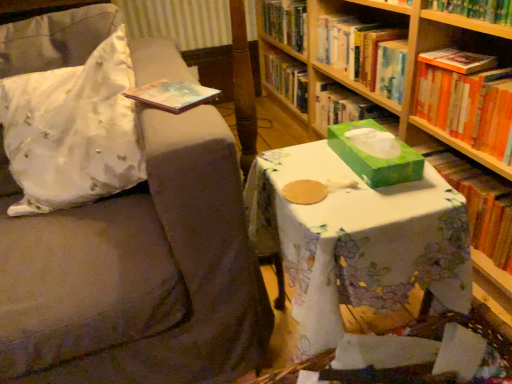
What do you see at coordinates (361, 51) in the screenshot? I see `hardcover book at upper right, the 1th book positioned from the top` at bounding box center [361, 51].

The image size is (512, 384). What are the coordinates of `white satin pillow at upper left` in the screenshot? It's located at (73, 131).

Identify the location of green paper book at right, which ranks as the 1th book in bottom-to-top order. The image size is (512, 384). (478, 202).

Describe the element at coordinates (375, 157) in the screenshot. I see `green paper tissue box at center` at that location.

Find the location of a particular element. The width and height of the screenshot is (512, 384). hardcover book at upper right, the 1th book positioned from the top is located at coordinates (361, 51).

From a real-world perspective, is white satin pillow at upper left positioned above or below green paper book at right, arranged as the 3th book when viewed from the top?

white satin pillow at upper left is situated higher than green paper book at right, arranged as the 3th book when viewed from the top, in the real world.

Between white satin pillow at upper left and green paper book at right, which ranks as the 1th book in bottom-to-top order, which one appears on the right side from the viewer's perspective?

Positioned to the right is green paper book at right, which ranks as the 1th book in bottom-to-top order.

Who is smaller, white satin pillow at upper left or green paper book at right, arranged as the 3th book when viewed from the top?

green paper book at right, arranged as the 3th book when viewed from the top.

Which of these two, white satin pillow at upper left or green paper book at right, arranged as the 3th book when viewed from the top, stands shorter?

With less height is green paper book at right, arranged as the 3th book when viewed from the top.

Are hardcover book at upper right, the 1th book positioned from the top, and orange hardcover book at right, the second book positioned from the bottom, far apart?

No, hardcover book at upper right, the 1th book positioned from the top, is in close proximity to orange hardcover book at right, the second book positioned from the bottom.

Between hardcover book at upper right, which appears as the 3th book when ordered from the bottom, and orange hardcover book at right, placed as the 2th book when sorted from top to bottom, which one has more height?

Standing taller between the two is orange hardcover book at right, placed as the 2th book when sorted from top to bottom.

Who is bigger, hardcover book at upper right, which appears as the 3th book when ordered from the bottom, or orange hardcover book at right, placed as the 2th book when sorted from top to bottom?

hardcover book at upper right, which appears as the 3th book when ordered from the bottom, is bigger.

Which object is closer to the camera taking this photo, hardcover book at upper right, which appears as the 3th book when ordered from the bottom, or orange hardcover book at right, the second book positioned from the bottom?

orange hardcover book at right, the second book positioned from the bottom, is closer to the camera.

Does hardcover book at upper right, the 1th book positioned from the top, have a larger size compared to matte gray swivel chair at center?

Actually, hardcover book at upper right, the 1th book positioned from the top, might be smaller than matte gray swivel chair at center.

Looking at this image, could you tell me if hardcover book at upper right, which appears as the 3th book when ordered from the bottom, is turned towards matte gray swivel chair at center?

Yes, hardcover book at upper right, which appears as the 3th book when ordered from the bottom, is facing matte gray swivel chair at center.

Looking at this image, which object is positioned more to the left, hardcover book at upper right, which appears as the 3th book when ordered from the bottom, or matte gray swivel chair at center?

matte gray swivel chair at center is more to the left.

Are hardcover book at upper right, the 1th book positioned from the top, and matte gray swivel chair at center located far from each other?

hardcover book at upper right, the 1th book positioned from the top, is far away from matte gray swivel chair at center.

Which of these two, orange hardcover book at right, the second book positioned from the bottom, or floral-patterned cloth at center, stands shorter?

Standing shorter between the two is orange hardcover book at right, the second book positioned from the bottom.

Is orange hardcover book at right, the second book positioned from the bottom, positioned before floral-patterned cloth at center?

No, it is behind floral-patterned cloth at center.

Does orange hardcover book at right, placed as the 2th book when sorted from top to bottom, have a smaller size compared to floral-patterned cloth at center?

Indeed, orange hardcover book at right, placed as the 2th book when sorted from top to bottom, has a smaller size compared to floral-patterned cloth at center.

Are orange hardcover book at right, the second book positioned from the bottom, and floral-patterned cloth at center located far from each other?

No, orange hardcover book at right, the second book positioned from the bottom, is not far away from floral-patterned cloth at center.

From the image's perspective, is orange hardcover book at right, placed as the 2th book when sorted from top to bottom, beneath matte gray swivel chair at center?

No, from the image's perspective, orange hardcover book at right, placed as the 2th book when sorted from top to bottom, is not below matte gray swivel chair at center.

Is the position of orange hardcover book at right, placed as the 2th book when sorted from top to bottom, less distant than that of matte gray swivel chair at center?

No, orange hardcover book at right, placed as the 2th book when sorted from top to bottom, is further to the viewer.

Does point (482, 80) appear closer or farther from the camera than point (219, 176)?

Point (482, 80) appears to be farther away from the viewer than point (219, 176).

Is orange hardcover book at right, placed as the 2th book when sorted from top to bottom, oriented towards matte gray swivel chair at center?

Yes.

Is orange hardcover book at right, the second book positioned from the bottom, a part of green paper tissue box at center?

No, green paper tissue box at center does not contain orange hardcover book at right, the second book positioned from the bottom.

Is green paper tissue box at center oriented towards orange hardcover book at right, the second book positioned from the bottom?

No, green paper tissue box at center does not turn towards orange hardcover book at right, the second book positioned from the bottom.

Does green paper tissue box at center appear on the left side of orange hardcover book at right, placed as the 2th book when sorted from top to bottom?

Yes, green paper tissue box at center is to the left of orange hardcover book at right, placed as the 2th book when sorted from top to bottom.

Does hardcover book at upper right, which appears as the 3th book when ordered from the bottom, have a smaller size compared to green paper tissue box at center?

Actually, hardcover book at upper right, which appears as the 3th book when ordered from the bottom, might be larger than green paper tissue box at center.

How many degrees apart are the facing directions of hardcover book at upper right, which appears as the 3th book when ordered from the bottom, and green paper tissue box at center?

The angular difference between hardcover book at upper right, which appears as the 3th book when ordered from the bottom, and green paper tissue box at center is 87.9 degrees.

From a real-world perspective, is hardcover book at upper right, which appears as the 3th book when ordered from the bottom, positioned over green paper tissue box at center based on gravity?

Incorrect, from a real-world perspective, hardcover book at upper right, which appears as the 3th book when ordered from the bottom, is lower than green paper tissue box at center.

Where is `throw pillow above the green paper book at right, which ranks as the 1th book in bottom-to-top order (from the image's perspective)`? throw pillow above the green paper book at right, which ranks as the 1th book in bottom-to-top order (from the image's perspective) is located at coordinates (73, 131).

From a real-world perspective, which book is the 1st one underneath the hardcover book at upper right, which appears as the 3th book when ordered from the bottom? Please provide its 2D coordinates.

[(467, 99)]

Based on their spatial positions, is orange hardcover book at right, placed as the 2th book when sorted from top to bottom, or hardcover book at upper right, which appears as the 3th book when ordered from the bottom, closer to floral-patterned cloth at center?

Based on the image, orange hardcover book at right, placed as the 2th book when sorted from top to bottom, appears to be nearer to floral-patterned cloth at center.

Considering their positions, is white satin pillow at upper left positioned further to floral-patterned cloth at center than orange hardcover book at right, the second book positioned from the bottom?

The object further to floral-patterned cloth at center is orange hardcover book at right, the second book positioned from the bottom.

Looking at the image, which one is located further to matte gray swivel chair at center, white satin pillow at upper left or orange hardcover book at right, the second book positioned from the bottom?

orange hardcover book at right, the second book positioned from the bottom, lies further to matte gray swivel chair at center than the other object.

Looking at the image, which one is located further to hardcover book at upper right, the 1th book positioned from the top, green cardboard bookcase at center or green paper book at right, which ranks as the 1th book in bottom-to-top order?

green paper book at right, which ranks as the 1th book in bottom-to-top order.

Considering their positions, is green paper book at right, which ranks as the 1th book in bottom-to-top order, positioned further to matte gray swivel chair at center than orange hardcover book at right, the second book positioned from the bottom?

green paper book at right, which ranks as the 1th book in bottom-to-top order, is further to matte gray swivel chair at center.

Looking at the image, which one is located closer to floral-patterned cloth at center, orange hardcover book at right, the second book positioned from the bottom, or green cardboard bookcase at center?

orange hardcover book at right, the second book positioned from the bottom, is positioned closer to the anchor floral-patterned cloth at center.

When comparing their distances from white satin pillow at upper left, does floral-patterned cloth at center or orange hardcover book at right, placed as the 2th book when sorted from top to bottom, seem closer?

floral-patterned cloth at center lies closer to white satin pillow at upper left than the other object.

Which object lies nearer to the anchor point green cardboard bookcase at center, white satin pillow at upper left or green paper tissue box at center?

Among the two, green paper tissue box at center is located nearer to green cardboard bookcase at center.

You are a GUI agent. You are given a task and a screenshot of the screen. Output one action in this format:
    pyautogui.click(x=<x>, y=<y>)
    Task: Click on the throw pillow located between matte gray swivel chair at center and green cardboard bookcase at center in the left-right direction
    This screenshot has height=384, width=512.
    Given the screenshot: What is the action you would take?
    pyautogui.click(x=73, y=131)

I want to click on box between white satin pillow at upper left and green paper book at right, which ranks as the 1th book in bottom-to-top order, in the horizontal direction, so click(375, 157).

The image size is (512, 384). I want to click on box located between floral-patterned cloth at center and orange hardcover book at right, placed as the 2th book when sorted from top to bottom, in the left-right direction, so (x=375, y=157).

Find the location of a particular element. The height and width of the screenshot is (384, 512). bookcase between hardcover book at upper right, the 1th book positioned from the top, and green paper book at right, which ranks as the 1th book in bottom-to-top order, in the up-down direction is located at coordinates (411, 99).